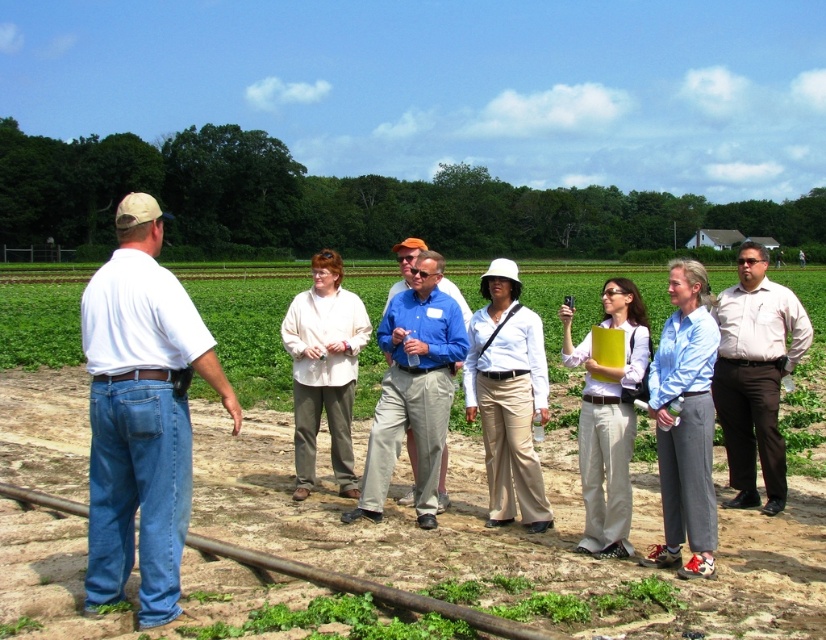
From the picture: You are a photographer trying to capture a group photo of the light brown shirt at center and the light beige shirt at center. Since you want to ensure both shirts are visible in the frame, which shirt should you focus on to accommodate the wider one?

The light brown shirt at center is wider than the light beige shirt at center, so you should focus on the light brown shirt at center to ensure it fits properly in the frame.

You are part of the group standing in the rural setting and need to locate the person wearing the light brown shirt at center. Since you are facing the group, which direction should you look relative to the person wearing the light beige shirt at center?

The light brown shirt at center is to the right of the light beige shirt at center, so you should look to the right side of the light beige shirt at center to find the light brown shirt at center.

You are a photographer trying to capture a group photo of the light blue shirt at center and the white cotton shirt at center. Based on their positions, which one should you focus on first to ensure both are in frame?

The light blue shirt at center might be wider than the white cotton shirt at center, so focusing on the light blue shirt at center first would ensure both are in frame.